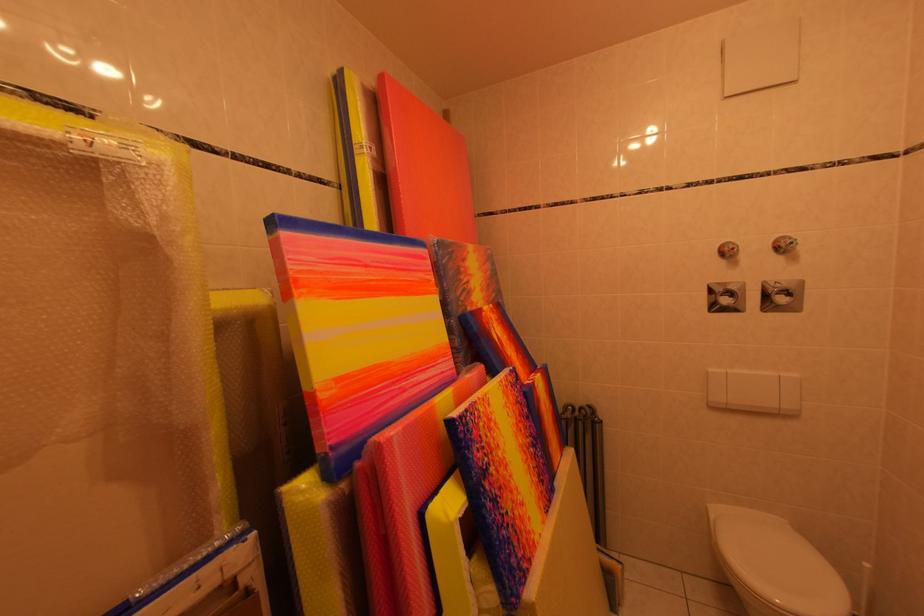
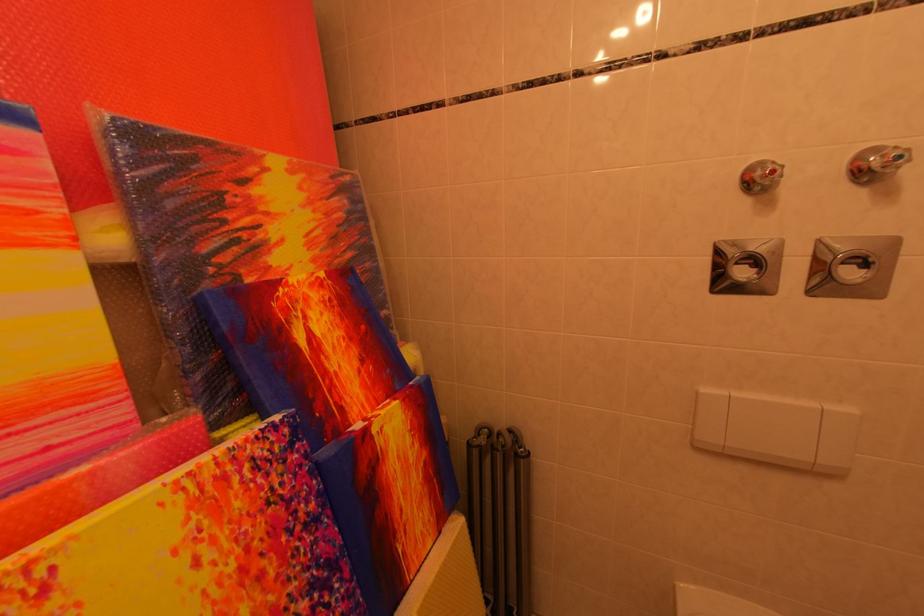
Where in the second image is the point corresponding to [799,246] from the first image?

(907, 161)